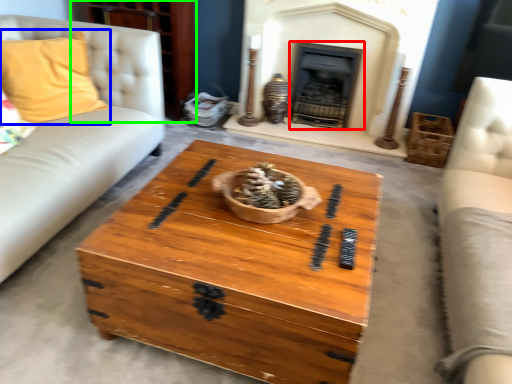
Question: Estimate the real-world distances between objects in this image. Which object is farther from fireplace (highlighted by a red box), pillow (highlighted by a blue box) or dresser (highlighted by a green box)?

Choices:
 (A) pillow
 (B) dresser

Answer: (A)